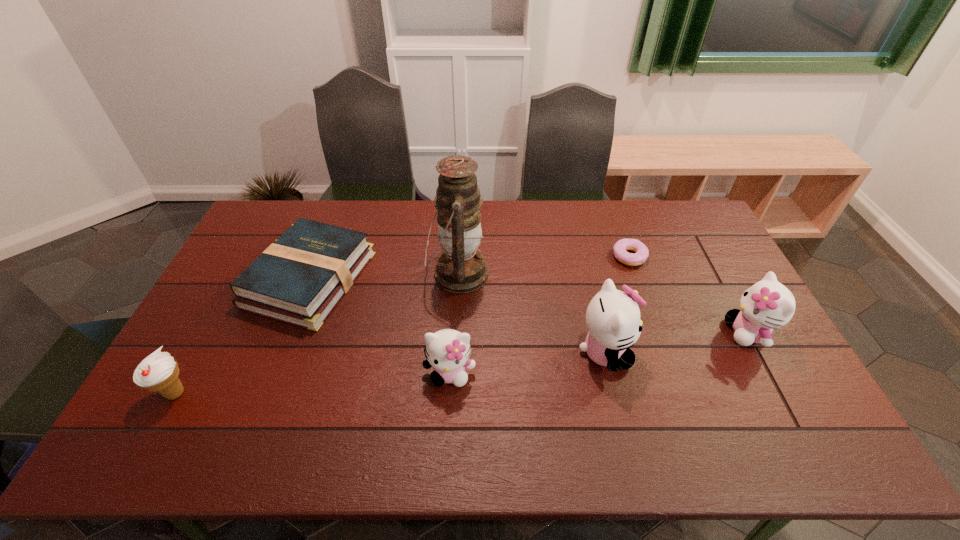
Where is `free point that keeps the kittens evenly spaced on the left`? The image size is (960, 540). free point that keeps the kittens evenly spaced on the left is located at coordinates (281, 396).